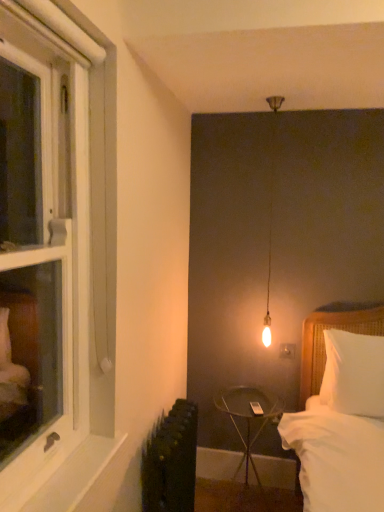
This screenshot has height=512, width=384. What do you see at coordinates (75, 475) in the screenshot?
I see `white painted wood at lower left` at bounding box center [75, 475].

Describe the element at coordinates (353, 373) in the screenshot. This screenshot has width=384, height=512. I see `white soft pillow at right` at that location.

The image size is (384, 512). What are the coordinates of `metallic black side table at center` in the screenshot? It's located at (248, 418).

Considering the positions of objects white wood window at left and matte white outlet at center-right in the image provided, who is more to the left, white wood window at left or matte white outlet at center-right?

Positioned to the left is white wood window at left.

Considering the points (82, 385) and (294, 352), which point is behind, point (82, 385) or point (294, 352)?

Positioned behind is point (294, 352).

Based on the photo, can you tell me how much white wood window at left and matte white outlet at center-right differ in facing direction?

The angular difference between white wood window at left and matte white outlet at center-right is 89.8 degrees.

Is white wood window at left positioned behind matte white outlet at center-right?

No, white wood window at left is in front of matte white outlet at center-right.

Is point (28, 494) farther from camera compared to point (374, 390)?

No, it is in front of (374, 390).

Does white wood window at left have a lesser height compared to white soft pillow at right?

No.

Would you say white wood window at left is a long distance from white soft pillow at right?

Yes, white wood window at left and white soft pillow at right are located far from each other.

Is metallic black side table at center in front of or behind matte white outlet at center-right in the image?

Clearly, metallic black side table at center is in front of matte white outlet at center-right.

Considering the relative positions of metallic black side table at center and matte white outlet at center-right in the image provided, is metallic black side table at center to the left or to the right of matte white outlet at center-right?

metallic black side table at center is to the left of matte white outlet at center-right.

Looking at this image, from the image's perspective, who appears lower, metallic black side table at center or matte white outlet at center-right?

metallic black side table at center is shown below in the image.

Does metallic black side table at center contain matte white outlet at center-right?

No.

Is white soft pillow at right taller than white wood window at left?

Incorrect, the height of white soft pillow at right is not larger of that of white wood window at left.

Is white soft pillow at right oriented away from white wood window at left?

That's not correct — white soft pillow at right is not looking away from white wood window at left.

Does point (356, 357) come farther from viewer compared to point (27, 30)?

Yes, point (356, 357) is farther from viewer.

In the image, is white soft pillow at right positioned in front of or behind white wood window at left?

white soft pillow at right is behind white wood window at left.

This screenshot has height=512, width=384. I want to click on pillow on the right of metallic black side table at center, so click(x=353, y=373).

Between point (246, 386) and point (367, 375), which one is positioned in front?

The point (367, 375) is closer to the camera.

Who is more distant, metallic black side table at center or white soft pillow at right?

Positioned behind is metallic black side table at center.

Considering the sizes of metallic black side table at center and white soft pillow at right in the image, is metallic black side table at center bigger or smaller than white soft pillow at right?

In the image, metallic black side table at center appears to be larger than white soft pillow at right.

Would you say white painted wood at lower left is part of metallic black side table at center's contents?

No.

From the image's perspective, which object appears higher, metallic black side table at center or white painted wood at lower left?

white painted wood at lower left appears higher in the image.

In the scene shown: Considering the sizes of metallic black side table at center and white painted wood at lower left in the image, is metallic black side table at center wider or thinner than white painted wood at lower left?

Clearly, metallic black side table at center has more width compared to white painted wood at lower left.

Is metallic black side table at center not near white painted wood at lower left?

metallic black side table at center is positioned a significant distance from white painted wood at lower left.

From the picture: What's the angular difference between metallic black side table at center and white wood window at left's facing directions?

The angular difference between metallic black side table at center and white wood window at left is 90.8 degrees.

Where is `window on the left of the metallic black side table at center`? window on the left of the metallic black side table at center is located at coordinates (53, 261).

Considering the relative positions of metallic black side table at center and white wood window at left in the image provided, is metallic black side table at center to the left or to the right of white wood window at left?

Based on their positions, metallic black side table at center is located to the right of white wood window at left.

From the image's perspective, which object appears higher, metallic black side table at center or white wood window at left?

white wood window at left is shown above in the image.

You are a GUI agent. You are given a task and a screenshot of the screen. Output one action in this format:
    pyautogui.click(x=<x>, y=<y>)
    Task: Click on the electric outlet that is below the white wood window at left (from the image's perspective)
    The width and height of the screenshot is (384, 512).
    Given the screenshot: What is the action you would take?
    pyautogui.click(x=287, y=351)

In order to click on window in front of the white soft pillow at right in this screenshot , I will do `click(53, 261)`.

Estimate the real-world distances between objects in this image. Which object is closer to metallic black side table at center, matte white outlet at center-right or white painted wood at lower left?

matte white outlet at center-right lies closer to metallic black side table at center than the other object.

From the picture: Which object lies nearer to the anchor point metallic black side table at center, matte white outlet at center-right or white wood window at left?

matte white outlet at center-right is positioned closer to the anchor metallic black side table at center.

When comparing their distances from white painted wood at lower left, does metallic black side table at center or matte white outlet at center-right seem further?

matte white outlet at center-right lies further to white painted wood at lower left than the other object.

From the image, which object appears to be farther from white wood window at left, matte white outlet at center-right or metallic black side table at center?

The object further to white wood window at left is matte white outlet at center-right.

Based on their spatial positions, is white wood window at left or white soft pillow at right further from white painted wood at lower left?

white soft pillow at right is further to white painted wood at lower left.

Estimate the real-world distances between objects in this image. Which object is further from matte white outlet at center-right, white painted wood at lower left or white wood window at left?

white wood window at left lies further to matte white outlet at center-right than the other object.

Looking at the image, which one is located closer to metallic black side table at center, white painted wood at lower left or white wood window at left?

white painted wood at lower left is positioned closer to the anchor metallic black side table at center.

Which object lies further to the anchor point white painted wood at lower left, metallic black side table at center or white soft pillow at right?

white soft pillow at right is positioned further to the anchor white painted wood at lower left.

Locate an element on the screen. The width and height of the screenshot is (384, 512). window sill positioned between white wood window at left and metallic black side table at center from near to far is located at coordinates (75, 475).

You are a GUI agent. You are given a task and a screenshot of the screen. Output one action in this format:
    pyautogui.click(x=<x>, y=<y>)
    Task: Click on the table between white wood window at left and matte white outlet at center-right in the front-back direction
    
    Given the screenshot: What is the action you would take?
    pyautogui.click(x=248, y=418)

Locate an element on the screen. This screenshot has width=384, height=512. electric outlet that lies between white soft pillow at right and metallic black side table at center from top to bottom is located at coordinates tap(287, 351).

Locate an element on the screen. This screenshot has width=384, height=512. pillow located between white painted wood at lower left and matte white outlet at center-right in the depth direction is located at coordinates (353, 373).